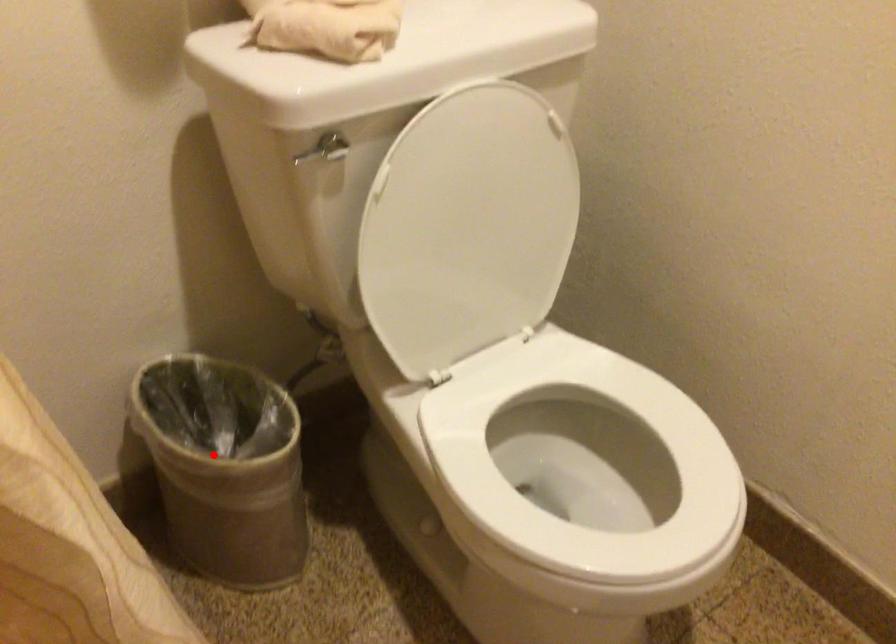
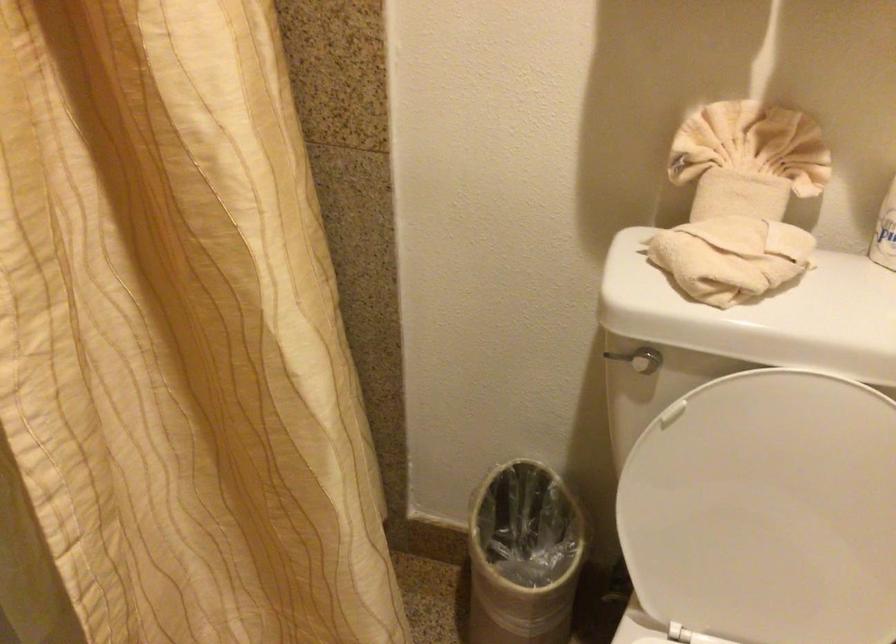
Question: I am providing you with two images of the same scene from different viewpoints. A red point is shown in image1. For the corresponding object point in image2, is it positioned nearer or farther from the camera?

Choices:
 (A) Nearer
 (B) Farther

Answer: (B)